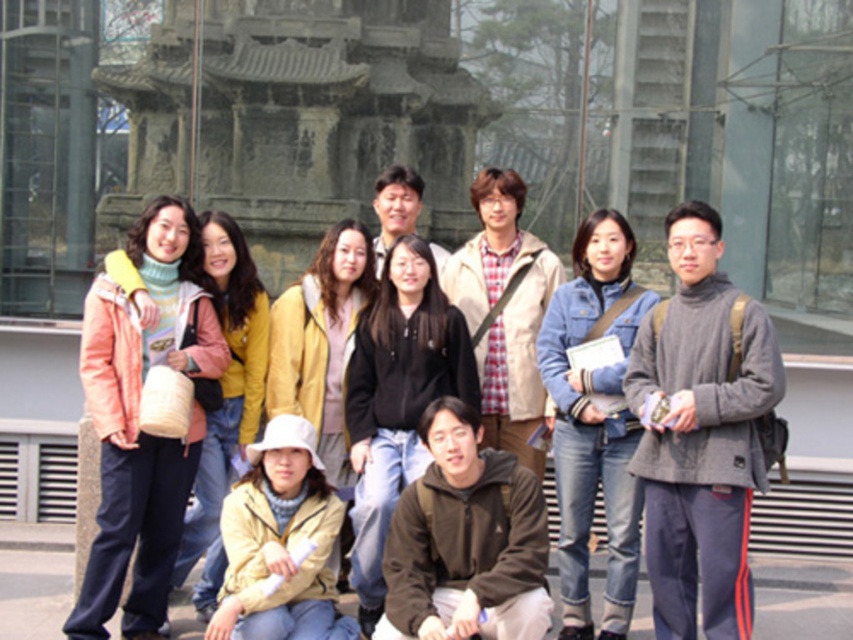
Who is positioned more to the right, pink fleece jacket at left or brown fleece jacket at lower center?

brown fleece jacket at lower center is more to the right.

Can you confirm if pink fleece jacket at left is positioned below brown fleece jacket at lower center?

No, pink fleece jacket at left is not below brown fleece jacket at lower center.

Image resolution: width=853 pixels, height=640 pixels. In order to click on pink fleece jacket at left in this screenshot , I will do `click(134, 422)`.

The height and width of the screenshot is (640, 853). Identify the location of pink fleece jacket at left. (134, 422).

Between pink fleece jacket at left and matte yellow jacket at upper left, which one has more height?

With more height is matte yellow jacket at upper left.

Who is more distant from viewer, (x=114, y=312) or (x=621, y=496)?

Positioned behind is point (x=621, y=496).

Locate an element on the screen. This screenshot has height=640, width=853. pink fleece jacket at left is located at coordinates (134, 422).

From the picture: Can you confirm if brown fleece jacket at lower center is positioned to the left of blue denim jeans at center?

Indeed, brown fleece jacket at lower center is positioned on the left side of blue denim jeans at center.

Between brown fleece jacket at lower center and blue denim jeans at center, which one is positioned lower?

brown fleece jacket at lower center is below.

Who is more distant from viewer, (527, 566) or (619, 337)?

Positioned behind is point (619, 337).

Identify the location of brown fleece jacket at lower center. (465, 540).